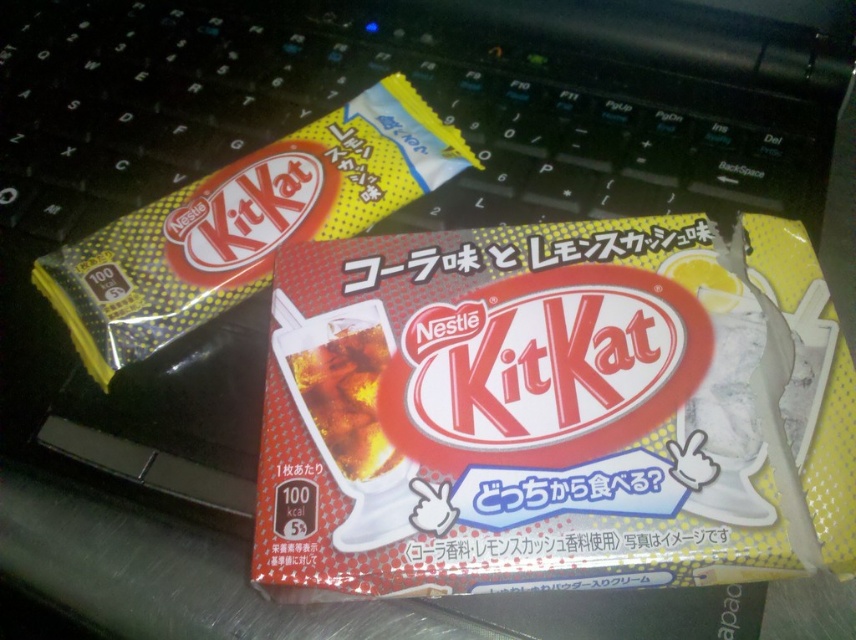
Does yellow matte kitkat bar at upper left have a lesser width compared to translucent plastic soda at center?

No.

Based on the photo, measure the distance between yellow matte kitkat bar at upper left and translucent plastic soda at center.

yellow matte kitkat bar at upper left is 27.34 centimeters away from translucent plastic soda at center.

At what (x,y) coordinates should I click in order to perform the action: click on yellow matte kitkat bar at upper left. Please return your answer as a coordinate pair (x, y). This screenshot has height=640, width=856. Looking at the image, I should click on (244, 225).

Does matte plastic kitkat at center have a greater height compared to yellow matte kitkat bar at upper left?

Incorrect, matte plastic kitkat at center's height is not larger of yellow matte kitkat bar at upper left's.

Based on the photo, between matte plastic kitkat at center and yellow matte kitkat bar at upper left, which one is positioned higher?

yellow matte kitkat bar at upper left is higher up.

Is point (694, 346) farther from camera compared to point (308, 225)?

No, (694, 346) is closer to viewer.

This screenshot has width=856, height=640. Identify the location of matte plastic kitkat at center. (556, 410).

Based on the photo, can you confirm if matte plastic kitkat at center is positioned to the left of translucent plastic soda at center?

No, matte plastic kitkat at center is not to the left of translucent plastic soda at center.

Between matte plastic kitkat at center and translucent plastic soda at center, which one is positioned higher?

Positioned higher is matte plastic kitkat at center.

Describe the element at coordinates (556, 410) in the screenshot. I see `matte plastic kitkat at center` at that location.

Locate an element on the screen. matte plastic kitkat at center is located at coordinates (556, 410).